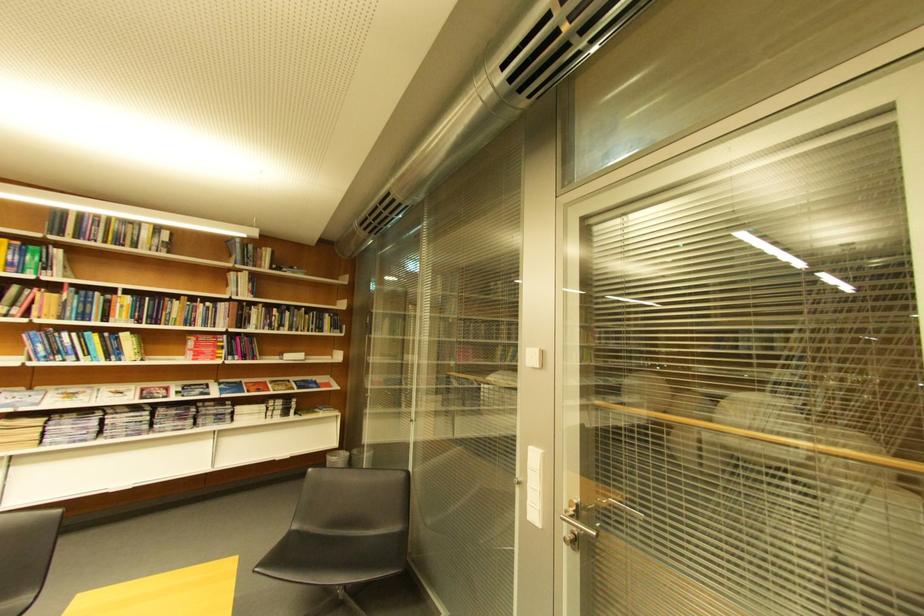
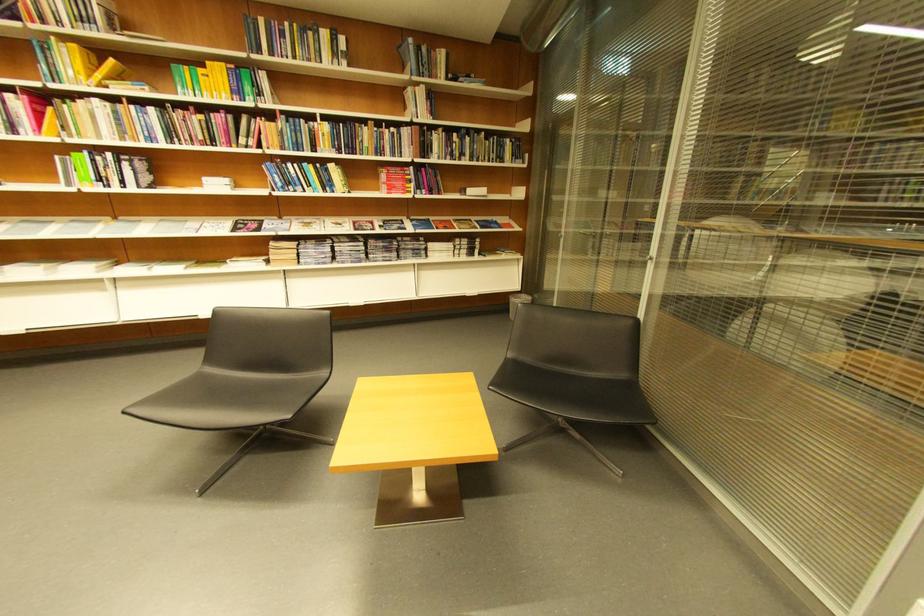
Find the pixel in the second image that matches point (219, 306) in the first image.

(403, 131)